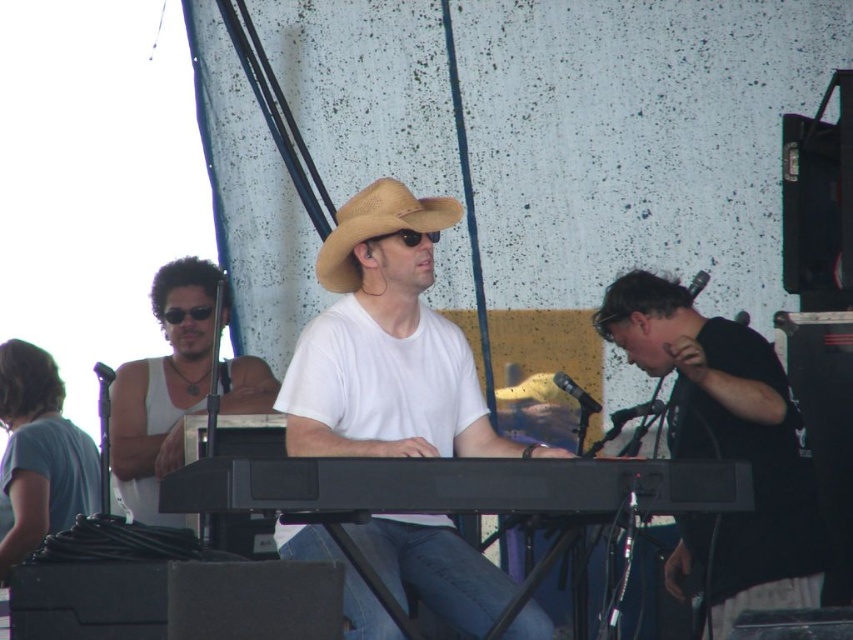
You are a photographer at the live music performance. You need to capture a photo where both the black matte shirt at center and the white tank top at left are visible. Based on their heights, which one might appear larger in the photo?

The black matte shirt at center appears larger in the photo because it has a greater height compared to the white tank top at left.

You are a photographer at the live music performance. You want to take a photo of the white matte shirt at center and the tan straw hat at center. Which object should you focus on first if you want to capture both in a single shot without moving the camera?

A: The white matte shirt at center is much taller than the tan straw hat at center, so you should focus on the white matte shirt at center first to ensure it is in frame and properly captured before adjusting for the tan straw hat at center.

You are a photographer setting up a camera to capture the live music performance. You need to ensure that both the white matte shirt at center and the tan straw hat at center are fully visible in the frame. Based on their positions and sizes, can you confirm if the shirt will not block the hat from being seen?

The white matte shirt at center might be wider than the tan straw hat at center, which could mean the shirt might partially block the hat from view. To ensure both are fully visible, adjust the camera angle or position to avoid overlap.